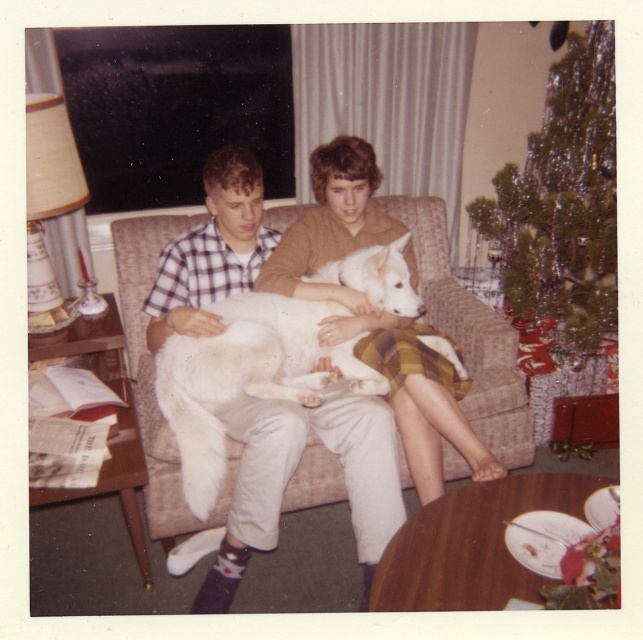
Is green shiny christmas tree at upper right thinner than white soft fur dog at center?

Indeed, green shiny christmas tree at upper right has a lesser width compared to white soft fur dog at center.

Between green shiny christmas tree at upper right and white soft fur dog at center, which one has less height?

white soft fur dog at center is shorter.

Which is in front, point (608, 54) or point (455, 385)?

Point (455, 385) is more forward.

Locate an element on the screen. The image size is (643, 640). green shiny christmas tree at upper right is located at coordinates (563, 202).

Does beige fabric couch at center have a larger size compared to white soft fur dog at center?

Indeed, beige fabric couch at center has a larger size compared to white soft fur dog at center.

Does beige fabric couch at center have a lesser width compared to white soft fur dog at center?

Incorrect, beige fabric couch at center's width is not less than white soft fur dog at center's.

Who is more forward, (156,465) or (413,337)?

Point (156,465) is in front.

This screenshot has width=643, height=640. I want to click on beige fabric couch at center, so click(x=471, y=337).

Is beige fabric couch at center above white fluffy dog at center?

No, beige fabric couch at center is not above white fluffy dog at center.

Can you confirm if beige fabric couch at center is smaller than white fluffy dog at center?

Incorrect, beige fabric couch at center is not smaller in size than white fluffy dog at center.

Who is more distant from viewer, (176, 470) or (377, 257)?

The point (377, 257) is behind.

At what (x,y) coordinates should I click in order to perform the action: click on beige fabric couch at center. Please return your answer as a coordinate pair (x, y). The image size is (643, 640). Looking at the image, I should click on (471, 337).